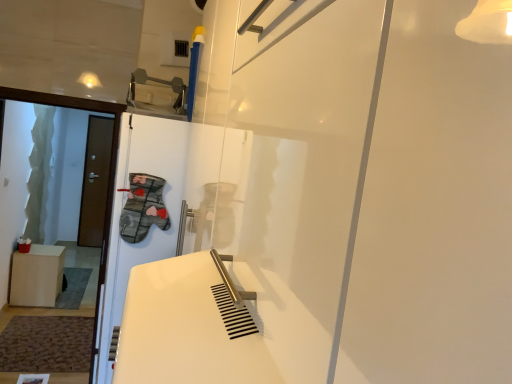
Question: From the image's perspective, is white matte screen door at center located above or below light brown wooden cabinet at left?

Choices:
 (A) above
 (B) below

Answer: (A)

Question: Is white matte screen door at center in front of or behind light brown wooden cabinet at left in the image?

Choices:
 (A) behind
 (B) front

Answer: (B)

Question: Which object is the farthest from the white matte screen door at center?

Choices:
 (A) brown matte door at left
 (B) light brown wooden cabinet at left

Answer: (A)

Question: Which is nearer to the brown matte door at left?

Choices:
 (A) light brown wooden cabinet at left
 (B) white matte screen door at center

Answer: (A)